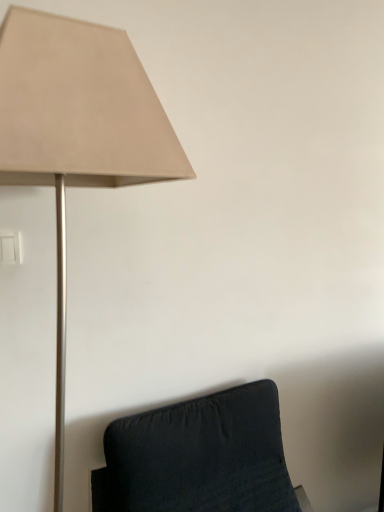
In order to face beige fabric lampshade at upper left, should I rotate leftwards or rightwards?

Turn left approximately 14.268 degrees to face it.

Locate an element on the screen. beige fabric lampshade at upper left is located at coordinates (77, 132).

What do you see at coordinates (77, 132) in the screenshot? I see `beige fabric lampshade at upper left` at bounding box center [77, 132].

Locate an element on the screen. velvet black cushion at lower right is located at coordinates (199, 457).

What do you see at coordinates (199, 457) in the screenshot? This screenshot has height=512, width=384. I see `velvet black cushion at lower right` at bounding box center [199, 457].

Locate an element on the screen. This screenshot has width=384, height=512. beige fabric lampshade at upper left is located at coordinates (77, 132).

Is velvet black cushion at lower right at the right side of beige fabric lampshade at upper left?

Correct, you'll find velvet black cushion at lower right to the right of beige fabric lampshade at upper left.

Is velvet black cushion at lower right positioned behind beige fabric lampshade at upper left?

That is True.

Is point (279, 472) positioned in front of point (106, 109)?

No, it is behind (106, 109).

From the image's perspective, does velvet black cushion at lower right appear lower than beige fabric lampshade at upper left?

Yes, from the image's perspective, velvet black cushion at lower right is below beige fabric lampshade at upper left.

From a real-world perspective, which object rests below the other?

velvet black cushion at lower right is physically lower.

Is velvet black cushion at lower right wider or thinner than beige fabric lampshade at upper left?

In the image, velvet black cushion at lower right appears to be wider than beige fabric lampshade at upper left.

Considering the sizes of objects velvet black cushion at lower right and beige fabric lampshade at upper left in the image provided, who is shorter, velvet black cushion at lower right or beige fabric lampshade at upper left?

With less height is velvet black cushion at lower right.

Can you confirm if velvet black cushion at lower right is smaller than beige fabric lampshade at upper left?

Actually, velvet black cushion at lower right might be larger than beige fabric lampshade at upper left.

Would you say beige fabric lampshade at upper left is part of velvet black cushion at lower right's contents?

No, velvet black cushion at lower right does not contain beige fabric lampshade at upper left.

Can you see velvet black cushion at lower right touching beige fabric lampshade at upper left?

No, velvet black cushion at lower right is not making contact with beige fabric lampshade at upper left.

Is beige fabric lampshade at upper left at the back of velvet black cushion at lower right?

No, velvet black cushion at lower right is not facing away from beige fabric lampshade at upper left.

How different are the orientations of velvet black cushion at lower right and beige fabric lampshade at upper left in degrees?

The facing directions of velvet black cushion at lower right and beige fabric lampshade at upper left are 0.113 degrees apart.

Locate an element on the screen. The width and height of the screenshot is (384, 512). furniture behind the beige fabric lampshade at upper left is located at coordinates (199, 457).

Considering the relative positions of beige fabric lampshade at upper left and velvet black cushion at lower right in the image provided, is beige fabric lampshade at upper left to the left of velvet black cushion at lower right from the viewer's perspective?

Yes.

Is beige fabric lampshade at upper left positioned in front of velvet black cushion at lower right?

Yes, it is in front of velvet black cushion at lower right.

Which is in front, point (61, 89) or point (285, 504)?

The point (61, 89) is in front.

From the image's perspective, which is above, beige fabric lampshade at upper left or velvet black cushion at lower right?

From the image's view, beige fabric lampshade at upper left is above.

From a real-world perspective, does beige fabric lampshade at upper left sit lower than velvet black cushion at lower right?

No, from a real-world perspective, beige fabric lampshade at upper left is not under velvet black cushion at lower right.

Does beige fabric lampshade at upper left have a lesser width compared to velvet black cushion at lower right?

Correct, the width of beige fabric lampshade at upper left is less than that of velvet black cushion at lower right.

Considering the sizes of objects beige fabric lampshade at upper left and velvet black cushion at lower right in the image provided, who is taller, beige fabric lampshade at upper left or velvet black cushion at lower right?

beige fabric lampshade at upper left.

Consider the image. Which of these two, beige fabric lampshade at upper left or velvet black cushion at lower right, is smaller?

With smaller size is beige fabric lampshade at upper left.

Could velvet black cushion at lower right be considered to be inside beige fabric lampshade at upper left?

No, beige fabric lampshade at upper left does not contain velvet black cushion at lower right.

Is beige fabric lampshade at upper left directly adjacent to velvet black cushion at lower right?

No, beige fabric lampshade at upper left is not touching velvet black cushion at lower right.

Is beige fabric lampshade at upper left turned away from velvet black cushion at lower right?

That's not correct — beige fabric lampshade at upper left is not looking away from velvet black cushion at lower right.

Where is `furniture below the beige fabric lampshade at upper left (from the image's perspective)`? The height and width of the screenshot is (512, 384). furniture below the beige fabric lampshade at upper left (from the image's perspective) is located at coordinates (199, 457).

Where is `lamp that appears on the left of velvet black cushion at lower right`? The width and height of the screenshot is (384, 512). lamp that appears on the left of velvet black cushion at lower right is located at coordinates (77, 132).

At what (x,y) coordinates should I click in order to perform the action: click on lamp above the velvet black cushion at lower right (from a real-world perspective). Please return your answer as a coordinate pair (x, y). This screenshot has width=384, height=512. Looking at the image, I should click on (77, 132).